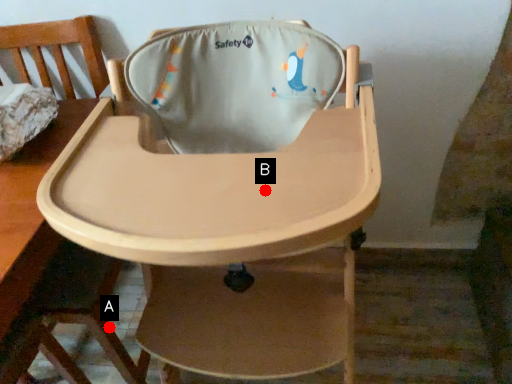
Question: Two points are circled on the image, labeled by A and B beside each circle. Among these points, which one is farthest from the camera?

Choices:
 (A) A is further
 (B) B is further

Answer: (A)